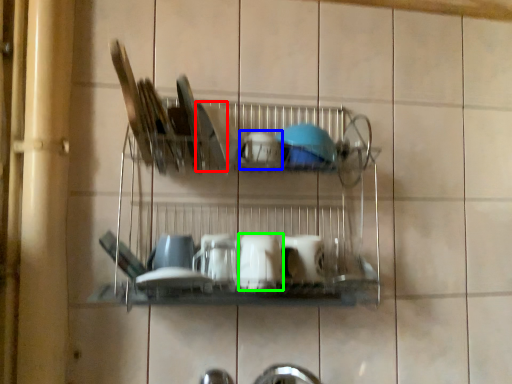
Question: Based on their relative distances, which object is farther from tableware (highlighted by a red box)? Choose from tableware (highlighted by a blue box) and tableware (highlighted by a green box).

Choices:
 (A) tableware
 (B) tableware

Answer: (B)